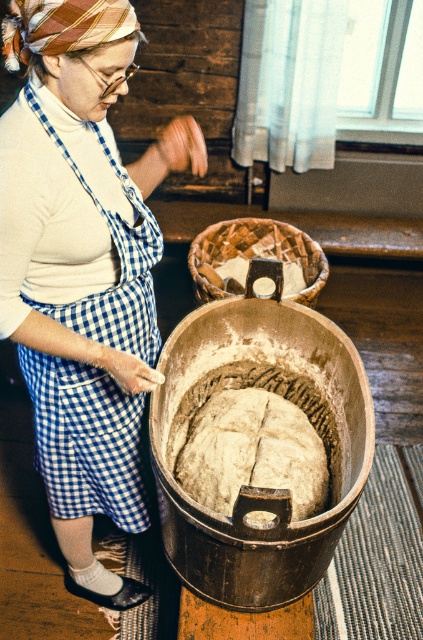
You are a baker who needs to move the spongy dough at center to the woven wood basket at center. Given that the distance between them is 85.74 centimeters, how many steps would you need to take if each step covers 30 centimeters?

The distance between the spongy dough at center and the woven wood basket at center is 85.74 centimeters. Since each step covers 30 centimeters, dividing 85.74 by 30 gives approximately 2.86 steps. Since you can only take whole steps, you would need to take 3 steps to cover the distance.

You are a baker who needs to place a new ingredient container on the counter. You have a white turtleneck at center and a wooden bowl at center in front of you. Which object should you place the container on if you want it to be more stable?

The wooden bowl at center has a greater width than the white turtleneck at center, so placing the container on the wooden bowl at center would provide a more stable surface.

You are a baker who needs to choose between the wooden bowl at center and the woven wood basket at center for mixing dough. Which one should you pick based on their sizes?

The wooden bowl at center is larger in size than the woven wood basket at center, so you should choose the wooden bowl at center for mixing dough.